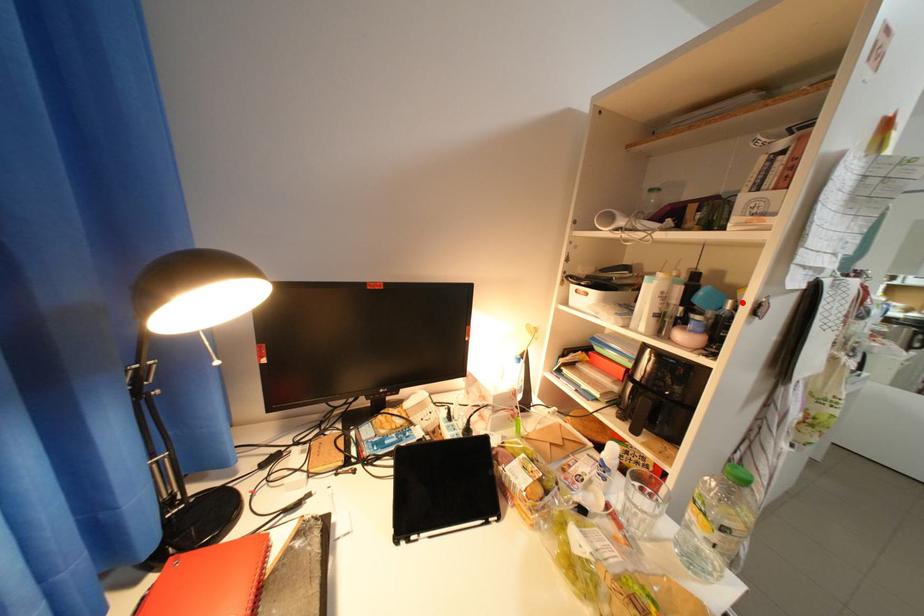
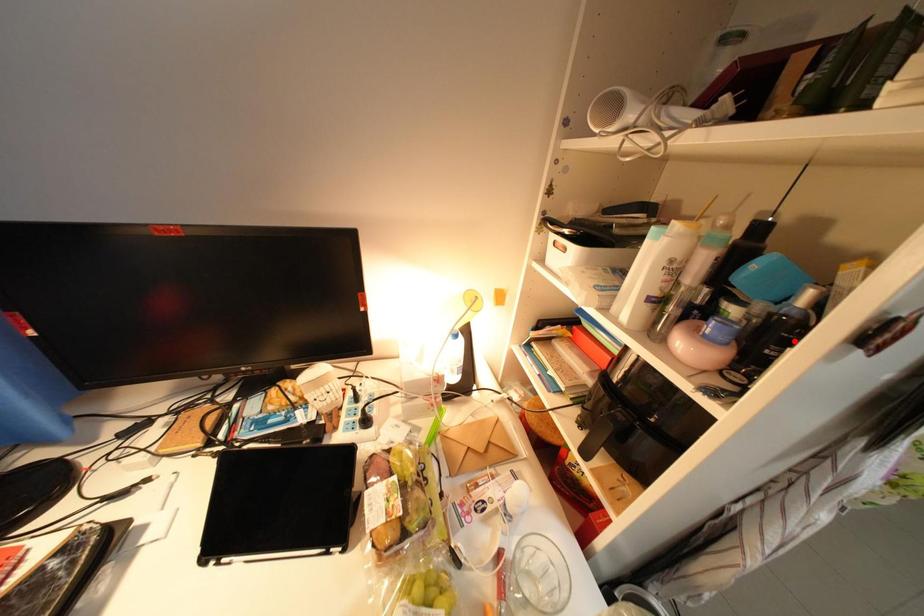
I am providing you with two images of the same scene from different viewpoints. A red point is marked on the first image and another point is marked on the second image. Does the point marked in image1 correspond to the same location as the one in image2?

No